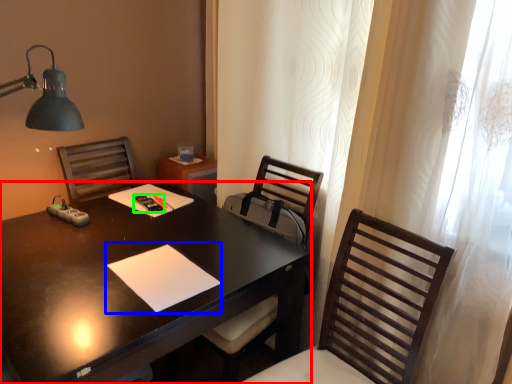
Question: Which is nearer to the desk (highlighted by a red box)? notepad (highlighted by a blue box) or remote control (highlighted by a green box).

Choices:
 (A) notepad
 (B) remote control

Answer: (A)